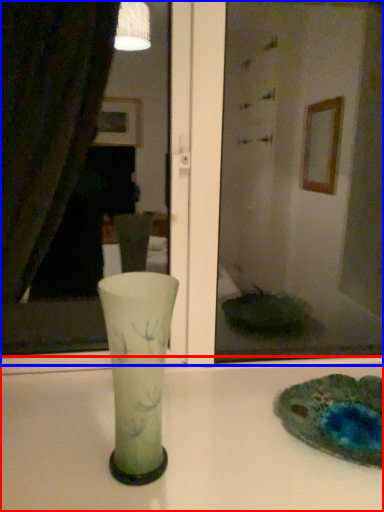
Question: Which object appears farthest to the camera in this image, counter top (highlighted by a red box) or mirror (highlighted by a blue box)?

Choices:
 (A) counter top
 (B) mirror

Answer: (B)